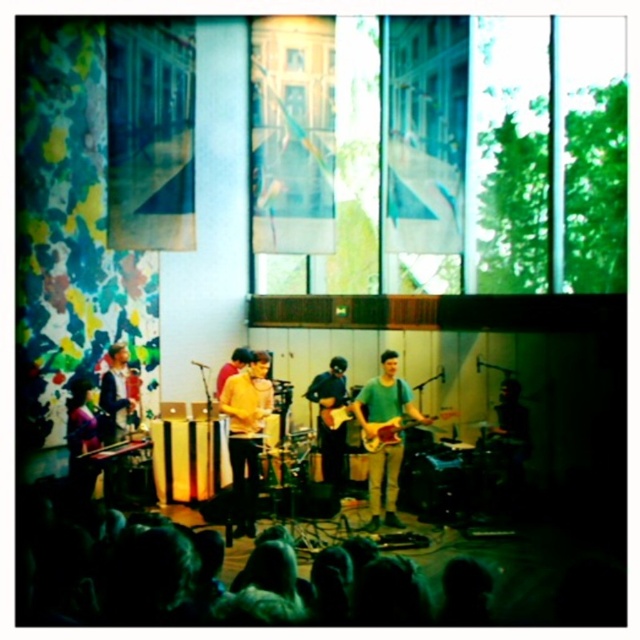
In the scene shown: Does matte yellow shirt at center have a greater height compared to wooden electric guitar at center?

Indeed, matte yellow shirt at center has a greater height compared to wooden electric guitar at center.

Which of these two, matte yellow shirt at center or wooden electric guitar at center, stands taller?

matte yellow shirt at center

Measure the distance between matte yellow shirt at center and camera.

matte yellow shirt at center is 7.46 meters away from camera.

The image size is (640, 640). Find the location of `matte yellow shirt at center`. matte yellow shirt at center is located at coordinates (246, 435).

Looking at this image, is matte yellow shirt at center smaller than wooden acoustic guitar at center?

No.

Is point (253, 470) positioned in front of point (339, 412)?

Yes, it is.

This screenshot has height=640, width=640. What are the coordinates of `matte yellow shirt at center` in the screenshot? It's located at (246, 435).

Is green matte guitar at center thinner than shiny black guitar at center?

Incorrect, green matte guitar at center's width is not less than shiny black guitar at center's.

Is green matte guitar at center above shiny black guitar at center?

No, green matte guitar at center is not above shiny black guitar at center.

The image size is (640, 640). Describe the element at coordinates (385, 397) in the screenshot. I see `green matte guitar at center` at that location.

Where is `green matte guitar at center`? This screenshot has height=640, width=640. green matte guitar at center is located at coordinates pyautogui.click(x=385, y=397).